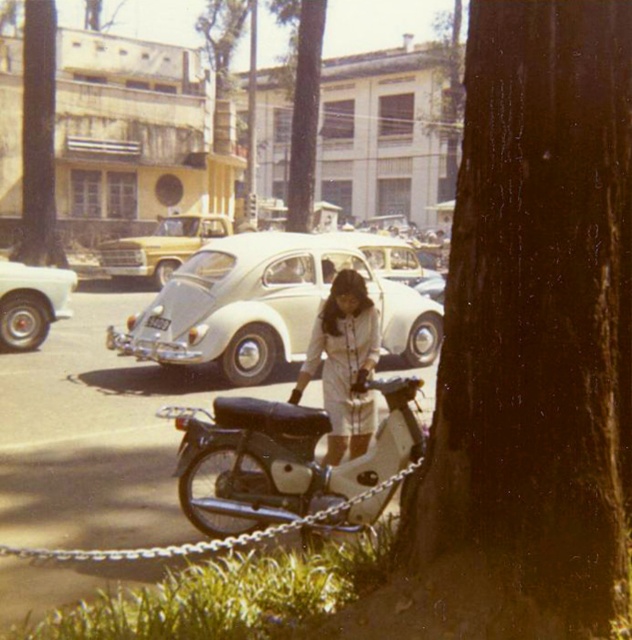
Consider the image. Does brown rough tree at upper left have a greater height compared to white glossy sedan at left?

Correct, brown rough tree at upper left is much taller as white glossy sedan at left.

Between point (25, 49) and point (39, 312), which one is positioned in front?

Point (39, 312) is in front.

Where is `brown rough tree at upper left`? This screenshot has height=640, width=632. brown rough tree at upper left is located at coordinates (39, 138).

In the scene shown: Is black matte motorcycle at center closer to the viewer compared to brown rough tree at upper left?

Yes, it is in front of brown rough tree at upper left.

The width and height of the screenshot is (632, 640). What do you see at coordinates (286, 456) in the screenshot? I see `black matte motorcycle at center` at bounding box center [286, 456].

Where is `black matte motorcycle at center`? This screenshot has height=640, width=632. black matte motorcycle at center is located at coordinates (286, 456).

From the picture: Is brown rough tree at upper left to the left of yellow matte car at center from the viewer's perspective?

Indeed, brown rough tree at upper left is positioned on the left side of yellow matte car at center.

Can you confirm if brown rough tree at upper left is taller than yellow matte car at center?

Yes, brown rough tree at upper left is taller than yellow matte car at center.

Describe the element at coordinates (39, 138) in the screenshot. I see `brown rough tree at upper left` at that location.

Where is `brown rough tree at upper left`? The image size is (632, 640). brown rough tree at upper left is located at coordinates (39, 138).